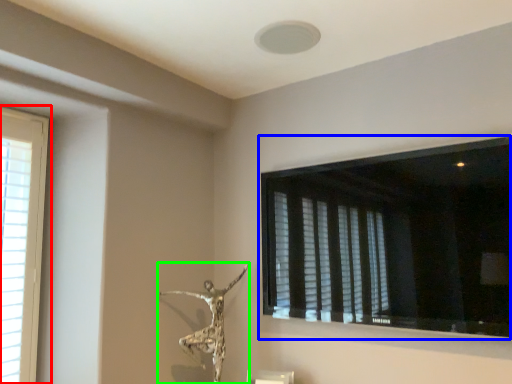
Question: Which is farther away from window (highlighted by a red box)? window (highlighted by a blue box) or sculpture (highlighted by a green box)?

Choices:
 (A) window
 (B) sculpture

Answer: (A)